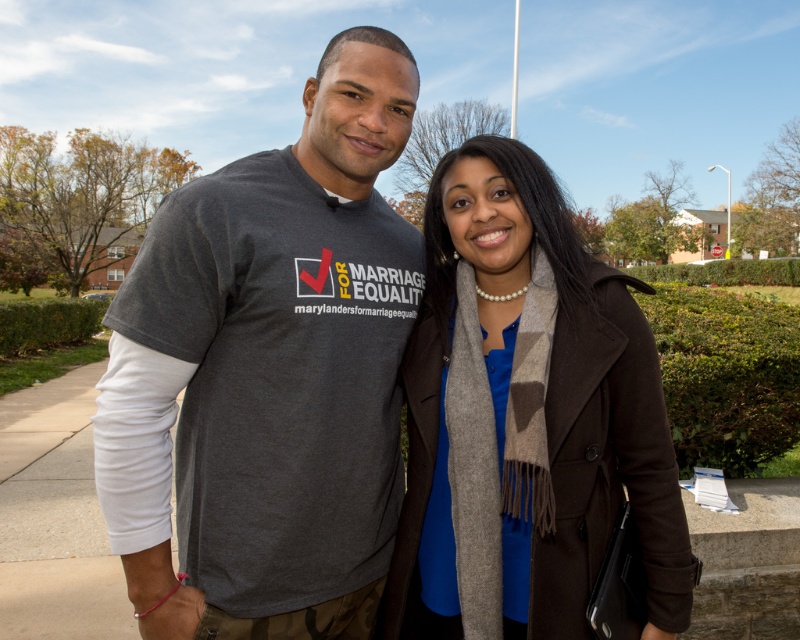
You are a photographer trying to focus on the dark gray t shirt at center. You notice a point at coordinates [280,365]. Is this point located on the dark gray t shirt at center?

Yes, the point [280,365] is located on the dark gray t shirt at center according to the description.

You are a photographer adjusting your camera to focus on two points in the image. The first point is at coordinates point (210, 237) and the second is at point (646, 416). Which point should you focus on first if you want to capture the closest object in the scene?

Point (210, 237) should be focused on first because it is closer to the viewer than point (646, 416).